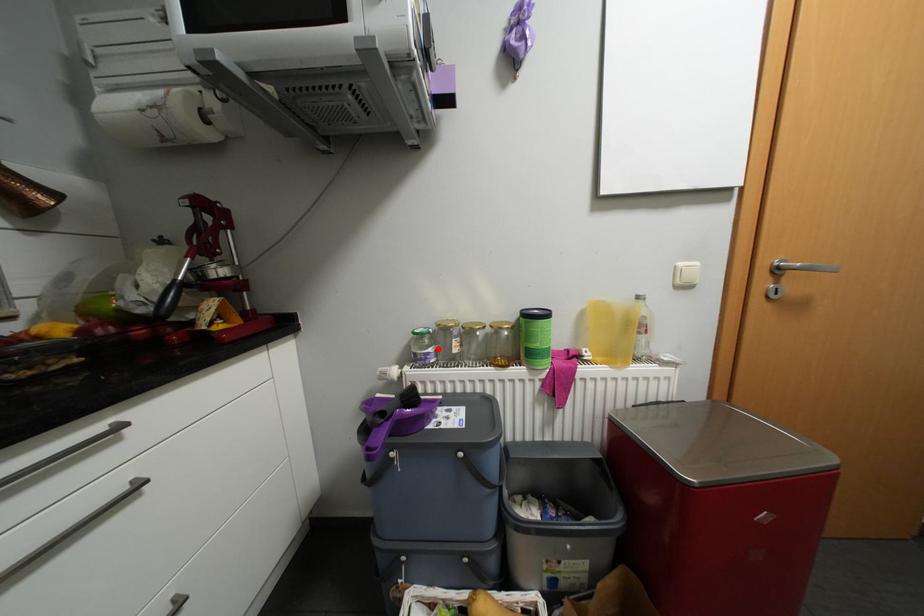
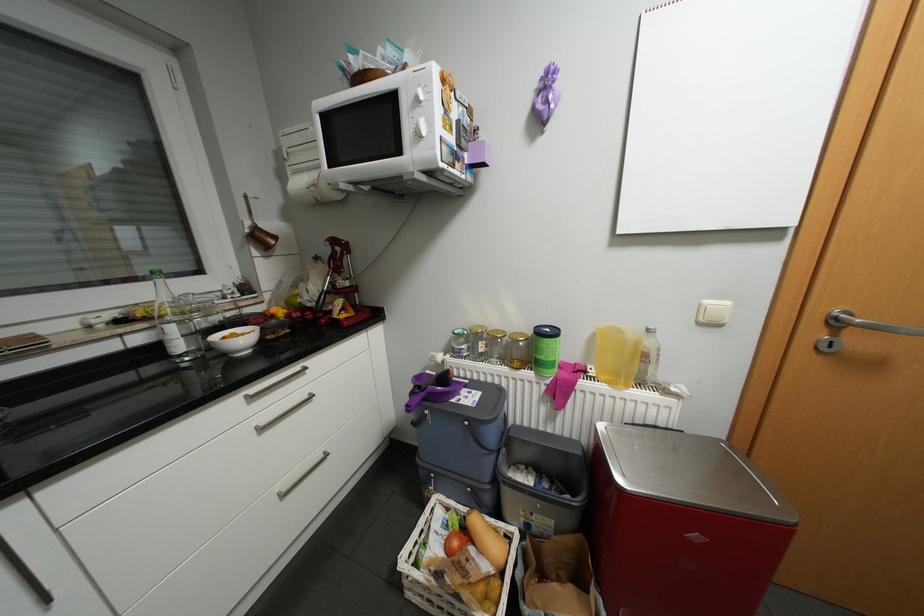
Question: I am providing you with two images of the same scene from different viewpoints. A red point is marked on the first image. Can you still see the location of the red point in image 2?

Choices:
 (A) Yes
 (B) No

Answer: (A)